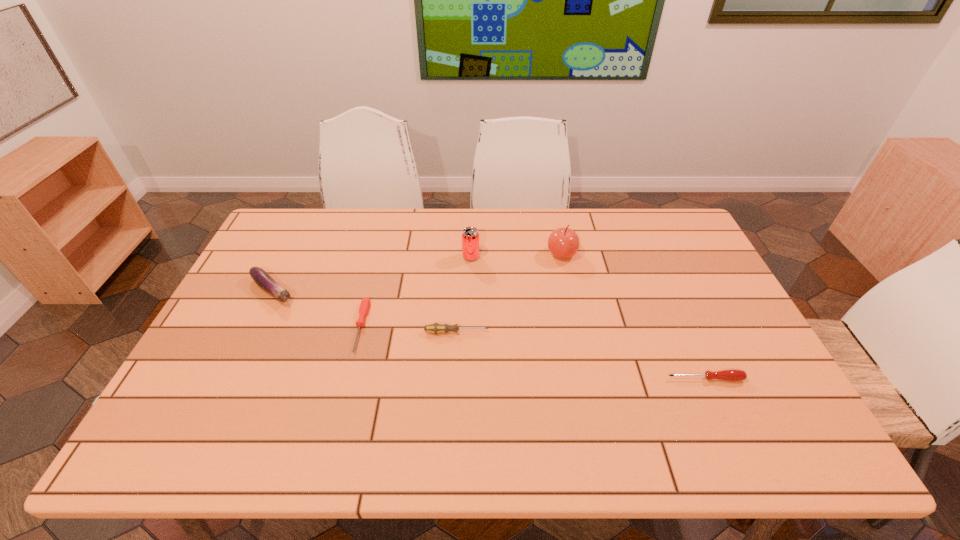
Locate an element on the screen. This screenshot has width=960, height=540. free point located on the left of the soda can is located at coordinates (444, 257).

Find the location of `vacant area located on the right of the leftmost object`. vacant area located on the right of the leftmost object is located at coordinates (331, 291).

Locate an element on the screen. Image resolution: width=960 pixels, height=540 pixels. vacant space positioned at the tip of the second screwdriver from left to right is located at coordinates (540, 332).

The image size is (960, 540). Find the location of `vacant space situated 0.360m on the left of the rightmost screwdriver`. vacant space situated 0.360m on the left of the rightmost screwdriver is located at coordinates (523, 379).

Where is `free space located 0.220m at the tip of the fifth object from right to left`? This screenshot has height=540, width=960. free space located 0.220m at the tip of the fifth object from right to left is located at coordinates (333, 434).

Find the location of a particular element. The height and width of the screenshot is (540, 960). object that is at the far edge is located at coordinates (563, 243).

You are a GUI agent. You are given a task and a screenshot of the screen. Output one action in this format:
    pyautogui.click(x=<x>, y=<y>)
    Task: Click on the object at the left edge
    This screenshot has width=960, height=540.
    Given the screenshot: What is the action you would take?
    pyautogui.click(x=262, y=278)

Find the location of `object that is at the right edge`. object that is at the right edge is located at coordinates (732, 374).

This screenshot has width=960, height=540. Identify the location of vacant space at the far edge. (552, 221).

In the image, there is a desktop. Identify the location of vacant area at the near edge. The height and width of the screenshot is (540, 960). (376, 448).